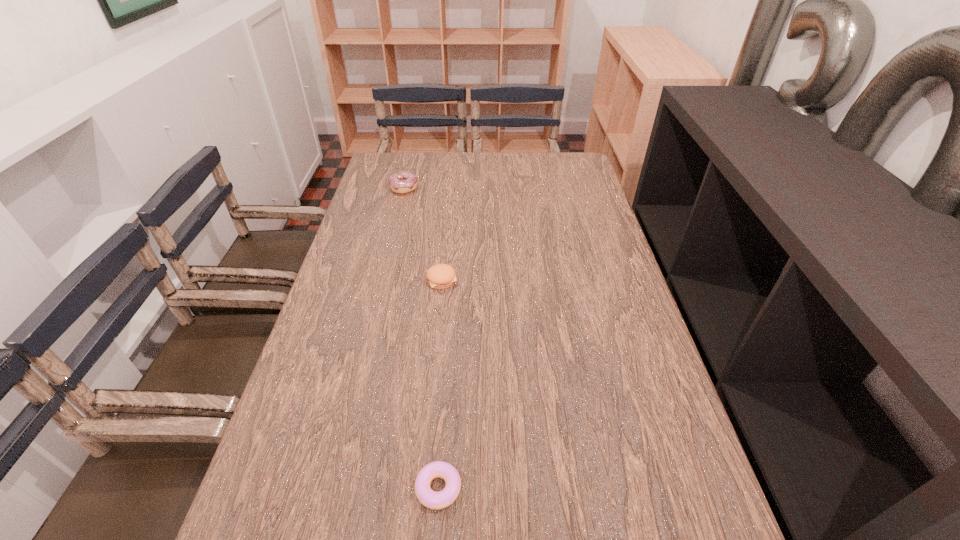
Identify the location of object that stands as the closest to the nearest object. (440, 276).